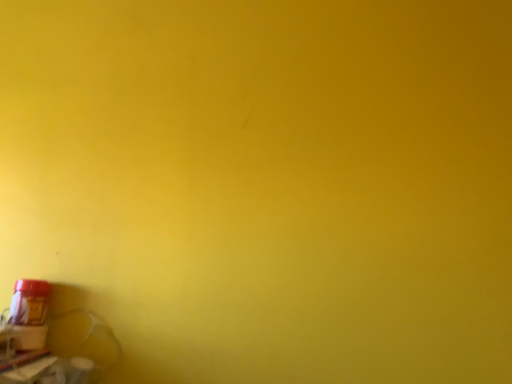
Question: Can you confirm if matte red plastic bottle at bottom left is shorter than matte plastic window sill at lower left?

Choices:
 (A) no
 (B) yes

Answer: (A)

Question: Can you confirm if matte red plastic bottle at bottom left is taller than matte plastic window sill at lower left?

Choices:
 (A) yes
 (B) no

Answer: (A)

Question: Is matte red plastic bottle at bottom left surrounding matte plastic window sill at lower left?

Choices:
 (A) yes
 (B) no

Answer: (B)

Question: Is matte red plastic bottle at bottom left thinner than matte plastic window sill at lower left?

Choices:
 (A) yes
 (B) no

Answer: (A)

Question: Is matte red plastic bottle at bottom left located outside matte plastic window sill at lower left?

Choices:
 (A) no
 (B) yes

Answer: (B)

Question: From a real-world perspective, is matte red plastic bottle at bottom left over matte plastic window sill at lower left?

Choices:
 (A) no
 (B) yes

Answer: (B)

Question: Does matte plastic window sill at lower left appear on the right side of matte red plastic bottle at bottom left?

Choices:
 (A) yes
 (B) no

Answer: (B)

Question: From a real-world perspective, does matte plastic window sill at lower left stand above matte red plastic bottle at bottom left?

Choices:
 (A) yes
 (B) no

Answer: (B)

Question: From the image's perspective, is matte plastic window sill at lower left located above matte red plastic bottle at bottom left?

Choices:
 (A) no
 (B) yes

Answer: (A)

Question: Considering the relative sizes of matte plastic window sill at lower left and matte red plastic bottle at bottom left in the image provided, is matte plastic window sill at lower left thinner than matte red plastic bottle at bottom left?

Choices:
 (A) yes
 (B) no

Answer: (B)

Question: Is matte red plastic bottle at bottom left inside matte plastic window sill at lower left?

Choices:
 (A) no
 (B) yes

Answer: (A)

Question: Is matte plastic window sill at lower left at the left side of matte red plastic bottle at bottom left?

Choices:
 (A) yes
 (B) no

Answer: (A)

Question: In terms of height, does matte plastic window sill at lower left look taller or shorter compared to matte red plastic bottle at bottom left?

Choices:
 (A) short
 (B) tall

Answer: (A)